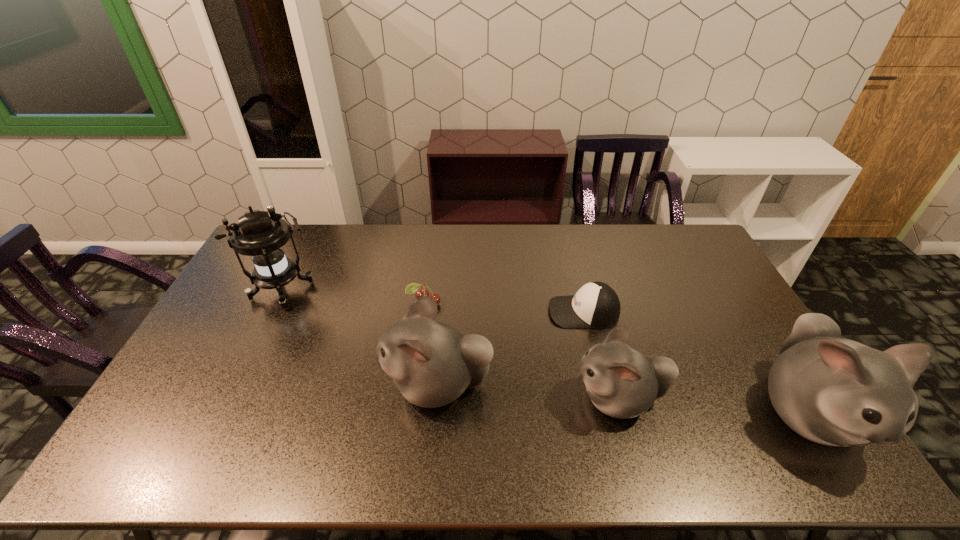
The height and width of the screenshot is (540, 960). I want to click on vacant space located 0.120m on the face of the second tallest hamster, so click(340, 385).

Locate an element on the screen. This screenshot has height=540, width=960. vacant area situated 0.350m on the face of the second hamster from left to right is located at coordinates (441, 399).

Where is `free region located 0.370m on the face of the second hamster from left to right`? free region located 0.370m on the face of the second hamster from left to right is located at coordinates (433, 399).

Where is `vacant area located 0.300m on the face of the second hamster from left to right`? vacant area located 0.300m on the face of the second hamster from left to right is located at coordinates (459, 399).

The image size is (960, 540). What are the coordinates of `free space located on the front panel of the cap` in the screenshot? It's located at (527, 312).

At what (x,y) coordinates should I click in order to perform the action: click on free space located on the front panel of the cap. Please return your answer as a coordinate pair (x, y). Image resolution: width=960 pixels, height=540 pixels. Looking at the image, I should click on (459, 312).

You are a GUI agent. You are given a task and a screenshot of the screen. Output one action in this format:
    pyautogui.click(x=<x>, y=<y>)
    Task: Click on the free space located on the front panel of the cap
    The image size is (960, 540).
    Given the screenshot: What is the action you would take?
    pyautogui.click(x=438, y=312)

The height and width of the screenshot is (540, 960). In order to click on vacant space located 0.330m on the right of the lantern in this screenshot , I will do point(415,292).

This screenshot has width=960, height=540. Identify the location of free location located on the leaves of the shortest object. (413, 382).

I want to click on object at the left edge, so click(262, 237).